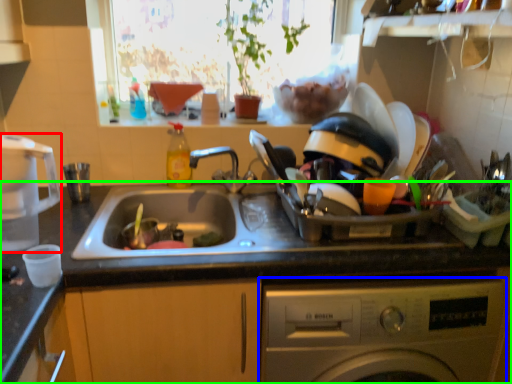
Question: Based on their relative distances, which object is nearer to appliance (highlighted by a red box)? Choose from washing machine (highlighted by a blue box) and countertop (highlighted by a green box).

Choices:
 (A) washing machine
 (B) countertop

Answer: (B)